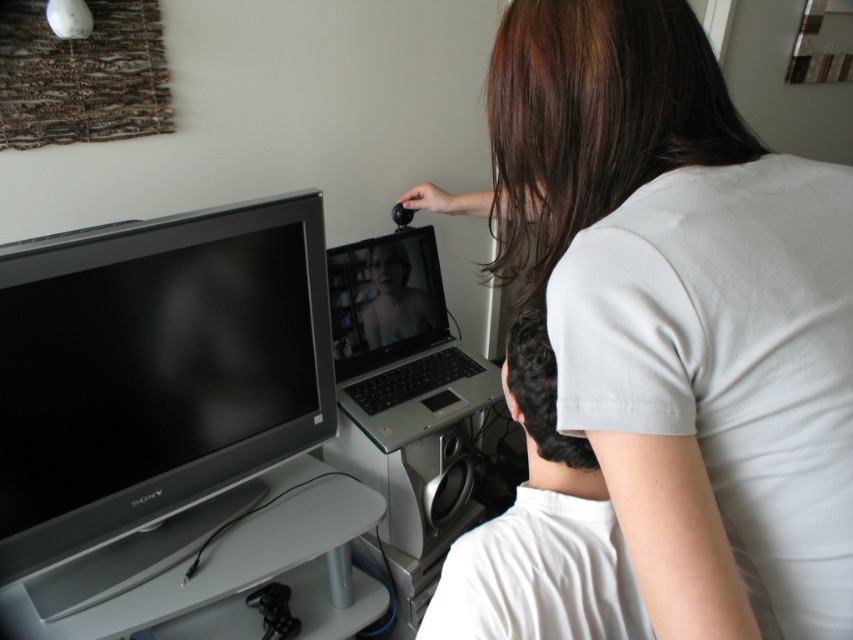
Is white matte shirt at upper right behind matte white laptop at center?

No, it is not.

This screenshot has height=640, width=853. What do you see at coordinates (680, 307) in the screenshot?
I see `white matte shirt at upper right` at bounding box center [680, 307].

The width and height of the screenshot is (853, 640). What are the coordinates of `white matte shirt at upper right` in the screenshot? It's located at (680, 307).

Who is more distant from viewer, (x=183, y=419) or (x=537, y=499)?

Positioned behind is point (x=183, y=419).

Is silver metallic flat-screen tv at left taller than white cotton shirt at upper right?

Indeed, silver metallic flat-screen tv at left has a greater height compared to white cotton shirt at upper right.

Find the location of a particular element. silver metallic flat-screen tv at left is located at coordinates click(x=152, y=387).

Which is behind, point (656, 352) or point (544, 340)?

The point (544, 340) is behind.

Between point (546, 56) and point (540, 442), which one is positioned in front?

Point (546, 56) is more forward.

Find the location of a particular element. The width and height of the screenshot is (853, 640). white matte shirt at upper right is located at coordinates point(680,307).